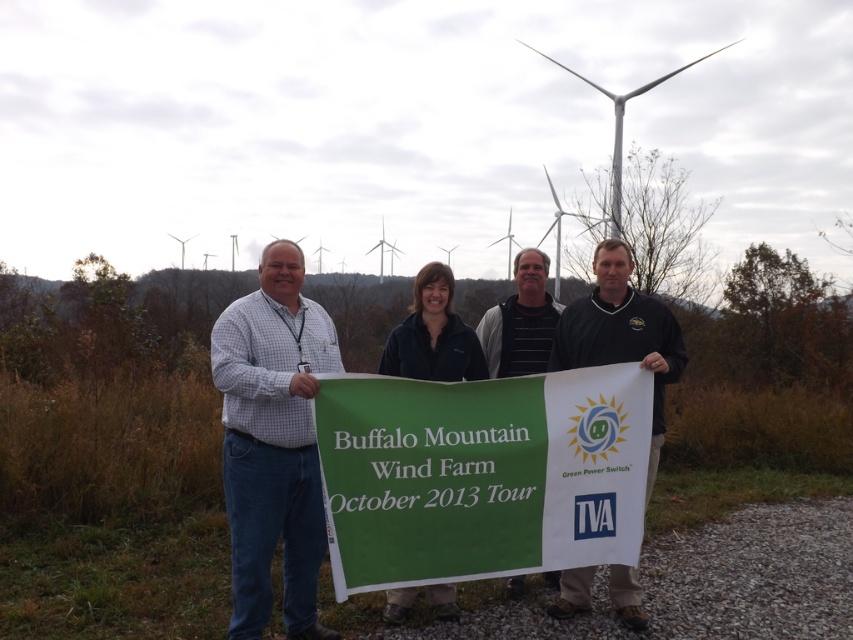
Consider the image. You are a photographer taking a group photo of the people in the scene. The checkered shirt at left and black fabric at center are two items you need to focus on. Which item should you adjust your camera focus to first if you want to capture both clearly?

The checkered shirt at left is in front of the black fabric at center, so you should focus on the checkered shirt at left first to ensure both are in focus since it is closer to the camera.

You are a photographer trying to capture the group photo of the Buffalo Mountain Wind Farm tour participants. You notice the checkered shirt at left and the black fabric at center. Which clothing item is positioned to the left of the other?

The checkered shirt at left is positioned on the left side of black fabric at center.

You are a photographer taking a group photo and notice the green paper banner at center and the checkered shirt at left. Which object takes up more space in the photo?

The checkered shirt at left takes up more space in the photo than the green paper banner at center because the banner occupies less space than the shirt according to the description.